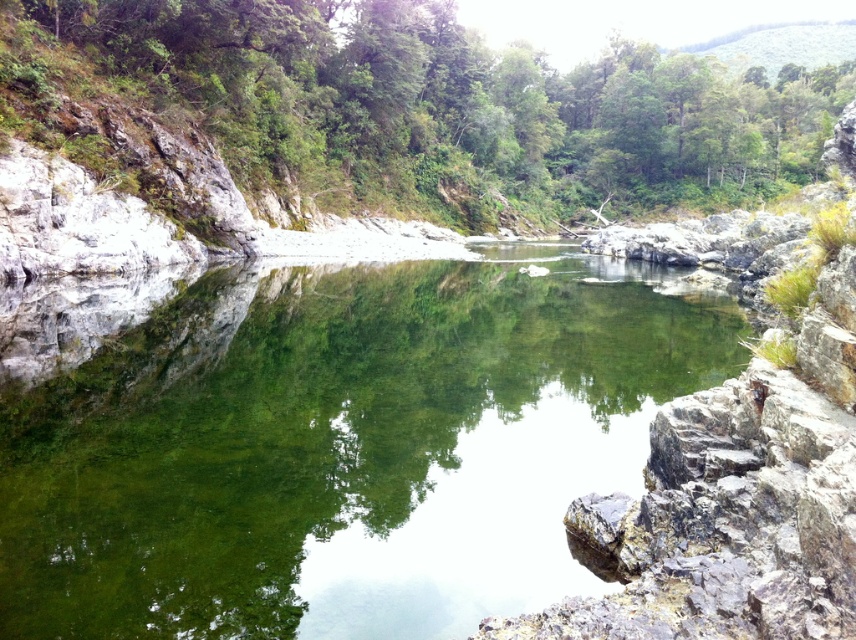
From the picture: Is clear glassy water at center below green leafy tree at center?

Yes.

This screenshot has width=856, height=640. Find the location of `clear glassy water at center`. clear glassy water at center is located at coordinates click(x=343, y=448).